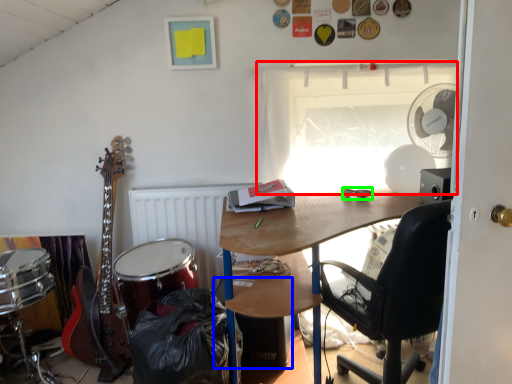
Question: Estimate the real-world distances between objects in this image. Which object is farther from window (highlighted by a red box), loudspeaker (highlighted by a blue box) or glasses (highlighted by a green box)?

Choices:
 (A) loudspeaker
 (B) glasses

Answer: (A)